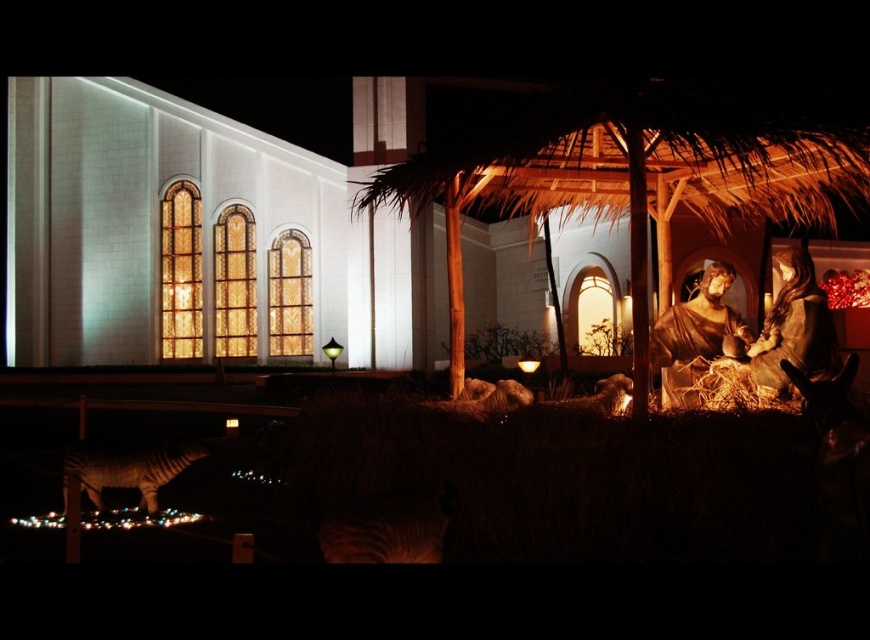
You are standing in front of the modern building with the nativity display. You see the white stone church at center and the striped fur tiger at lower left. Which object is closer to you?

The striped fur tiger at lower left is behind the white stone church at center, so the white stone church at center is closer to you.

You are standing at the entrance of the building in the image. You want to take a photo of the white stone church at center. Where should you position yourself to ensure the church is centered in your camera viewfinder?

To center the white stone church at center in your camera viewfinder, position yourself directly in front of it at point (191, 237).

You are standing at the entrance of the modern building with large arched windows. You want to place a small Christmas decoration exactly at the point marked as point [191,237]. What object will the decoration land on?

The decoration will land on the white stone church at center located at point [191,237].